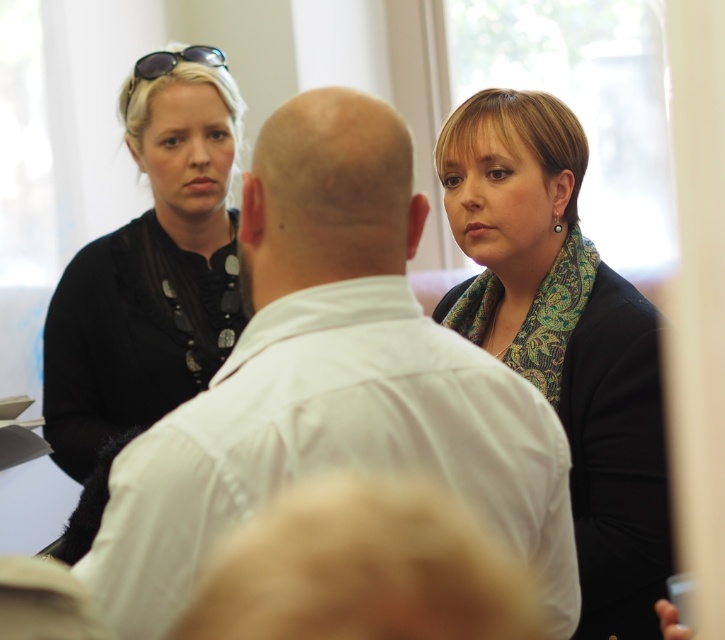
Question: Is dark green textured scarf at right to the right of black matte shirt at upper left from the viewer's perspective?

Choices:
 (A) yes
 (B) no

Answer: (A)

Question: Estimate the real-world distances between objects in this image. Which object is closer to the sunglasses at upper left?

Choices:
 (A) dark green textured scarf at right
 (B) white matte shirt at center

Answer: (A)

Question: Does dark green textured scarf at right have a larger size compared to black matte shirt at upper left?

Choices:
 (A) yes
 (B) no

Answer: (B)

Question: Considering the relative positions of white matte shirt at center and dark green textured scarf at right in the image provided, where is white matte shirt at center located with respect to dark green textured scarf at right?

Choices:
 (A) below
 (B) above

Answer: (A)

Question: Which point is farther to the camera?

Choices:
 (A) (220, 52)
 (B) (602, 470)
 (C) (91, 262)
 (D) (352, 257)

Answer: (C)

Question: Which of the following is the farthest from the observer?

Choices:
 (A) (157, 51)
 (B) (647, 557)
 (C) (178, 346)

Answer: (A)